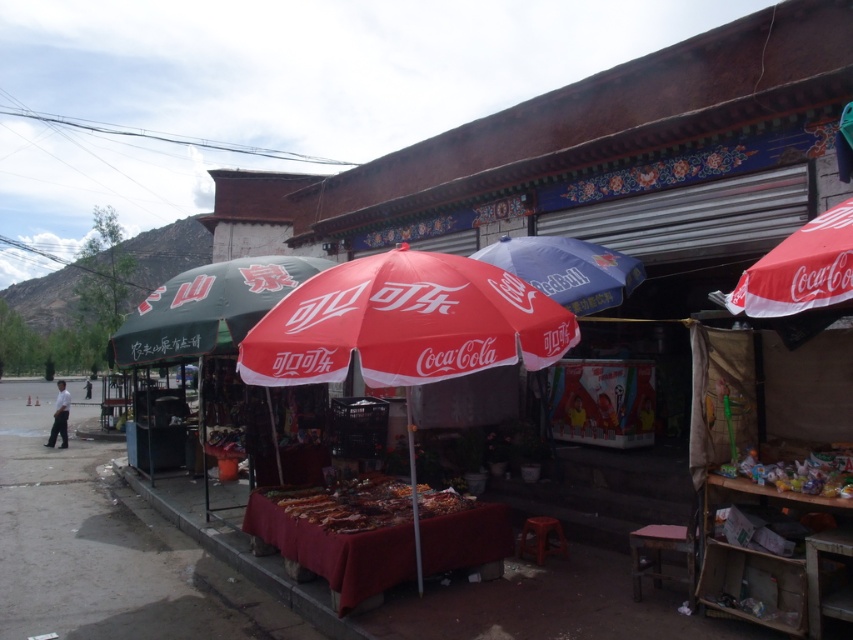
Question: Is red fabric coca-cola umbrella at center positioned before blue fabric coca-cola umbrella at center?

Choices:
 (A) yes
 (B) no

Answer: (A)

Question: Which object is closer to the camera taking this photo?

Choices:
 (A) gray concrete pavement at lower left
 (B) green fabric umbrella at left

Answer: (A)

Question: Estimate the real-world distances between objects in this image. Which object is closer to the red fabric coca-cola umbrella at center?

Choices:
 (A) blue fabric coca-cola umbrella at center
 (B) white matte shirt at left
 (C) green fabric umbrella at left
 (D) gray concrete pavement at lower left

Answer: (A)

Question: Which point is farther to the camera?

Choices:
 (A) (68, 392)
 (B) (846, 260)
 (C) (566, 285)

Answer: (A)

Question: Is green fabric umbrella at left positioned at the back of white matte shirt at left?

Choices:
 (A) yes
 (B) no

Answer: (B)

Question: Is white fabric coca-cola umbrella at right smaller than white matte shirt at left?

Choices:
 (A) yes
 (B) no

Answer: (A)